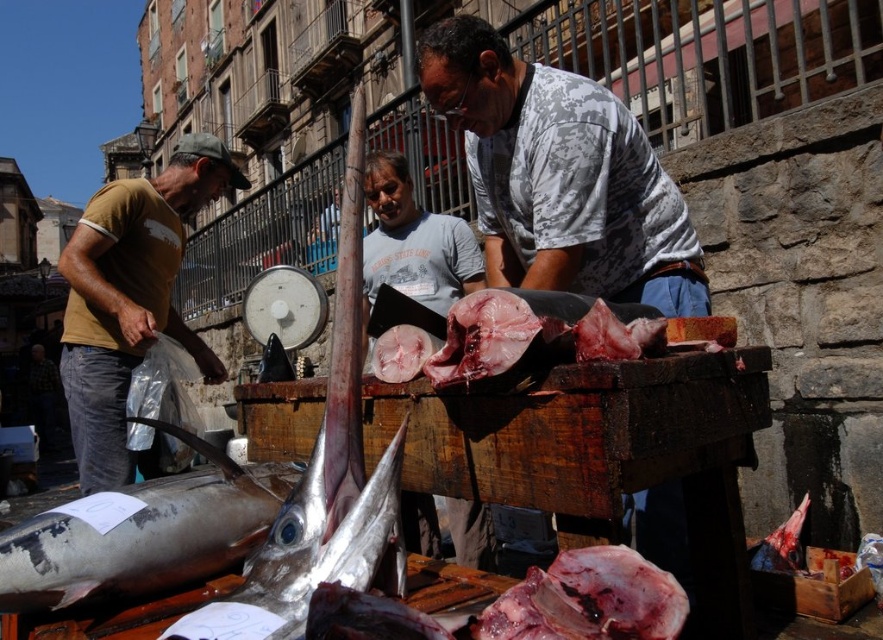
You are a delivery person standing at the entrance of the market. You need to place a package on the wooden table where the silver metallic fish at lower left is located. Based on the coordinates provided, can you determine if the package will fit on the table without overlapping the fish?

The silver metallic fish at lower left is located at point (141, 534). Since the coordinates are within the table area, the package can be placed on the table without overlapping the fish as long as it is positioned away from those coordinates.